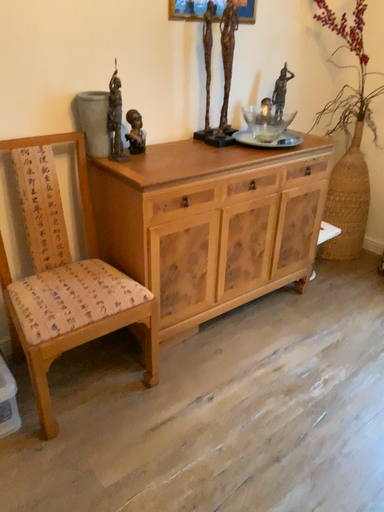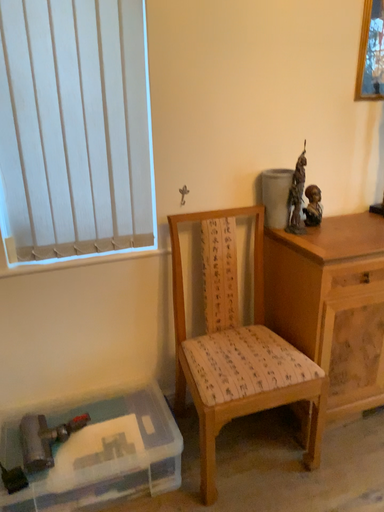
Question: Which way did the camera rotate in the video?

Choices:
 (A) rotated upward
 (B) rotated downward

Answer: (A)